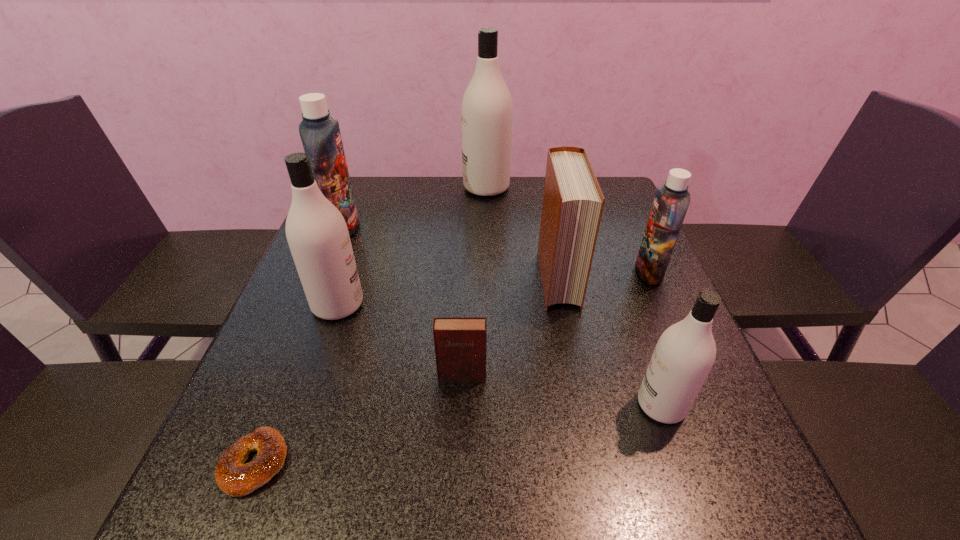
Where is `bagel present at the left edge`? bagel present at the left edge is located at coordinates pos(233,477).

Where is `object present at the far left corner`? object present at the far left corner is located at coordinates (320, 134).

Where is `object that is at the near left corner`? object that is at the near left corner is located at coordinates (233, 477).

Where is `free space at the far edge`? The height and width of the screenshot is (540, 960). free space at the far edge is located at coordinates (516, 194).

In the image, there is a desktop. Where is `vacant space at the near edge`? Image resolution: width=960 pixels, height=540 pixels. vacant space at the near edge is located at coordinates (321, 510).

Locate an element on the screen. vacant space at the left edge of the desktop is located at coordinates (336, 320).

Where is `vacant space at the right edge of the desktop`? Image resolution: width=960 pixels, height=540 pixels. vacant space at the right edge of the desktop is located at coordinates (733, 468).

Locate an element on the screen. vacant space at the far left corner is located at coordinates (x=359, y=204).

I want to click on vacant space at the near left corner of the desktop, so click(x=206, y=488).

You are a GUI agent. You are given a task and a screenshot of the screen. Output one action in this format:
    pyautogui.click(x=<x>, y=<y>)
    Task: Click on the free space between the sixth farthest object and the tallest shampoo
    Image resolution: width=960 pixels, height=540 pixels.
    Given the screenshot: What is the action you would take?
    pyautogui.click(x=474, y=281)